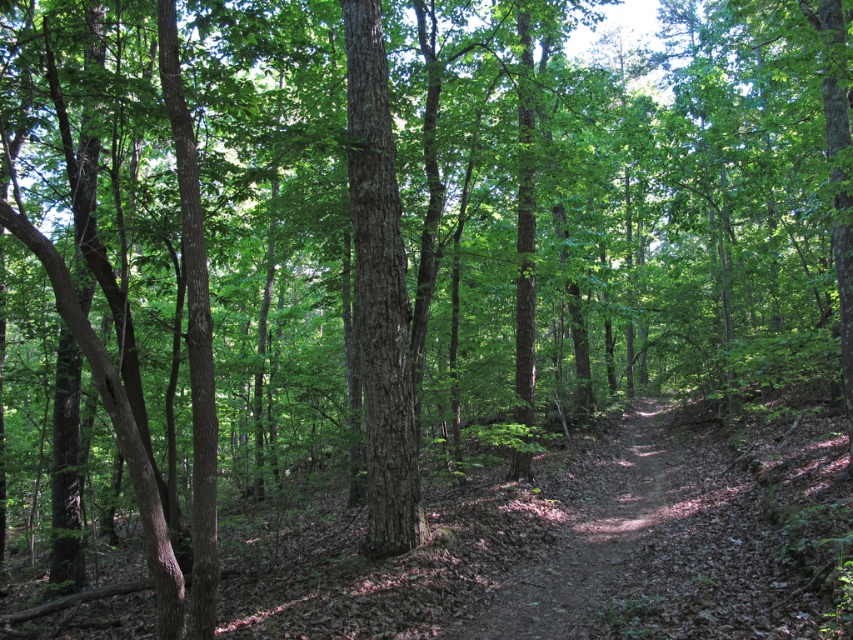
You are a hiker carrying a backpack and need to cross the brown dirt trail at center. The trail is 19.44 feet wide. Can you safely cross it in one stride?

The brown dirt trail at center is 19.44 feet wide. Since the average human stride is about 2.5 to 3 feet, it would be impossible to cross it in one stride. You would need to walk across it step by step.

You are standing at the center of the forest path. There is a point marked at coordinates (592, 541). Is this point on the brown dirt trail at center?

Yes, the brown dirt trail at center is located at point (592, 541), so the point is on the trail.